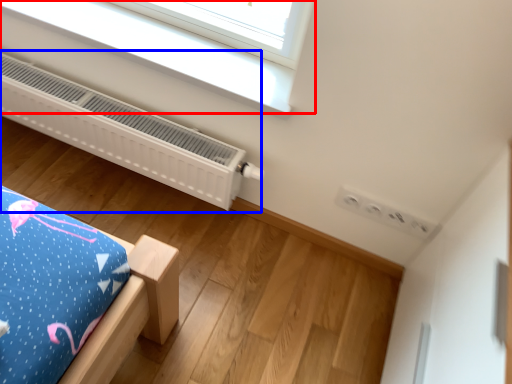
Question: Which object is further to the camera taking this photo, window (highlighted by a red box) or heater (highlighted by a blue box)?

Choices:
 (A) window
 (B) heater

Answer: (B)